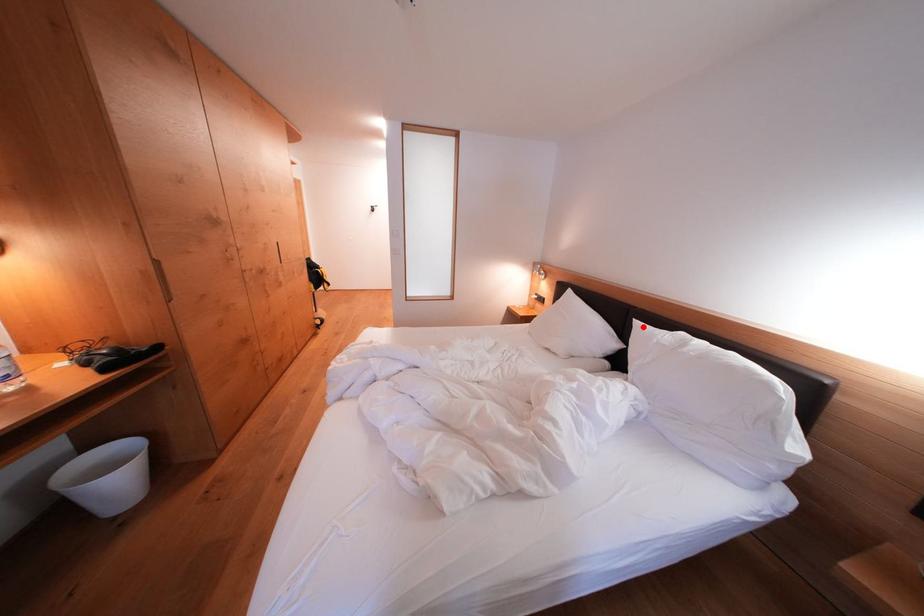
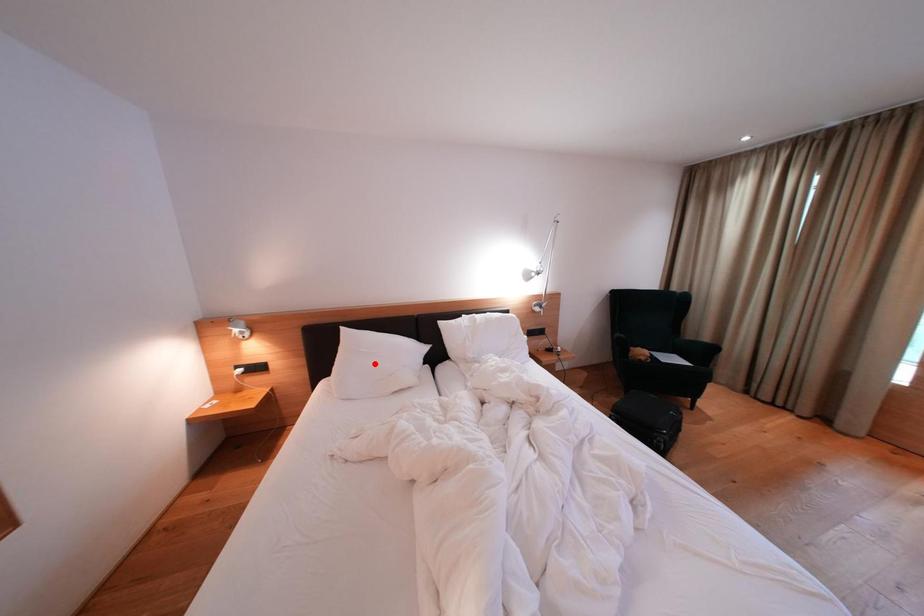
I am providing you with two images of the same scene from different viewpoints. A red point is marked on the first image and another point is marked on the second image. Is the red point in image1 aligned with the point shown in image2?

No